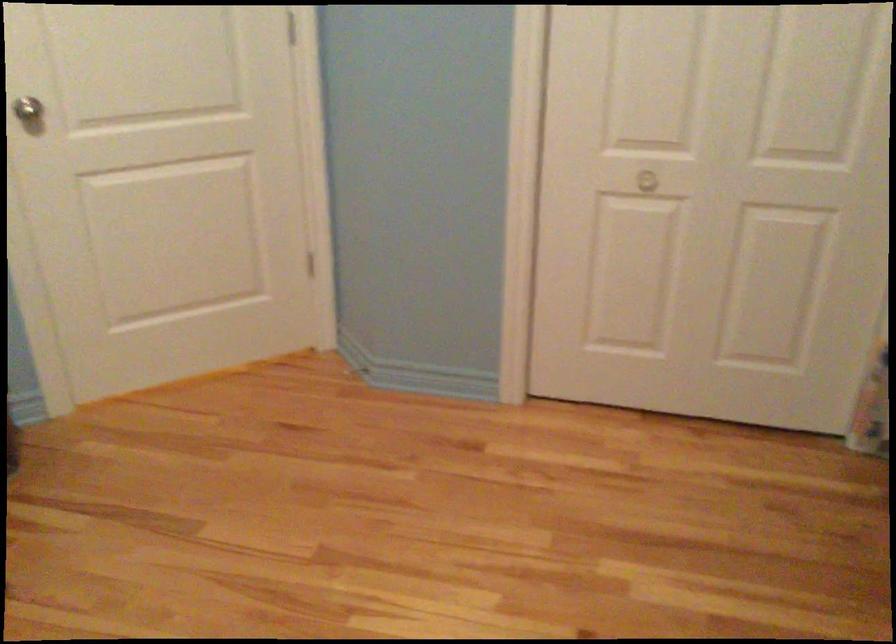
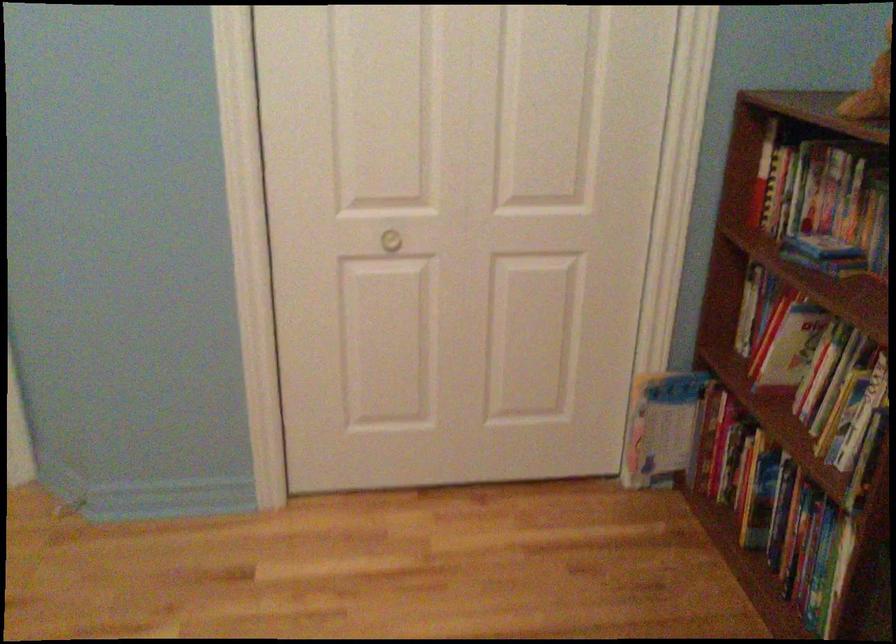
Question: Which direction would the cameraman need to move to produce the second image? Reply with the corresponding letter.

Choices:
 (A) Left
 (B) Right
 (C) Forward
 (D) Backward

Answer: (C)